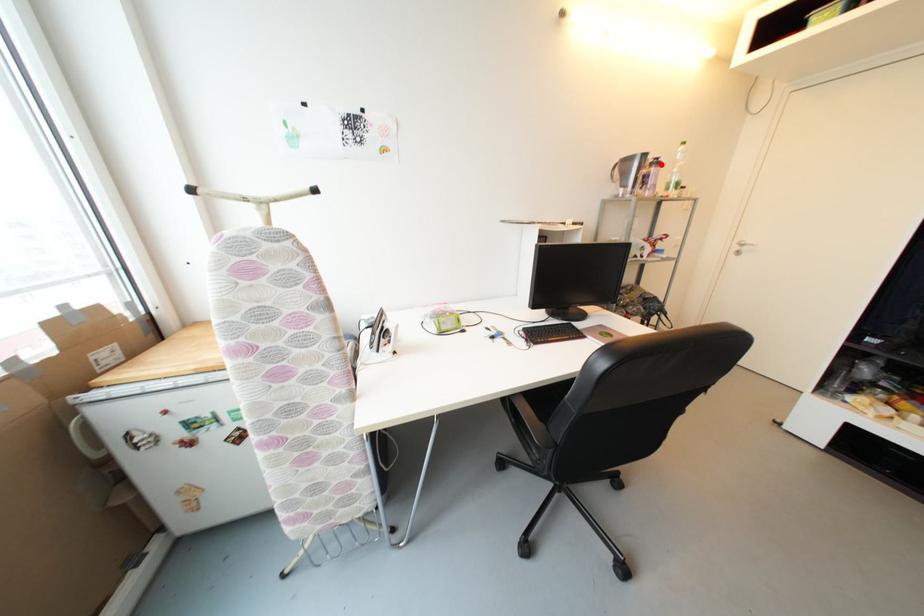
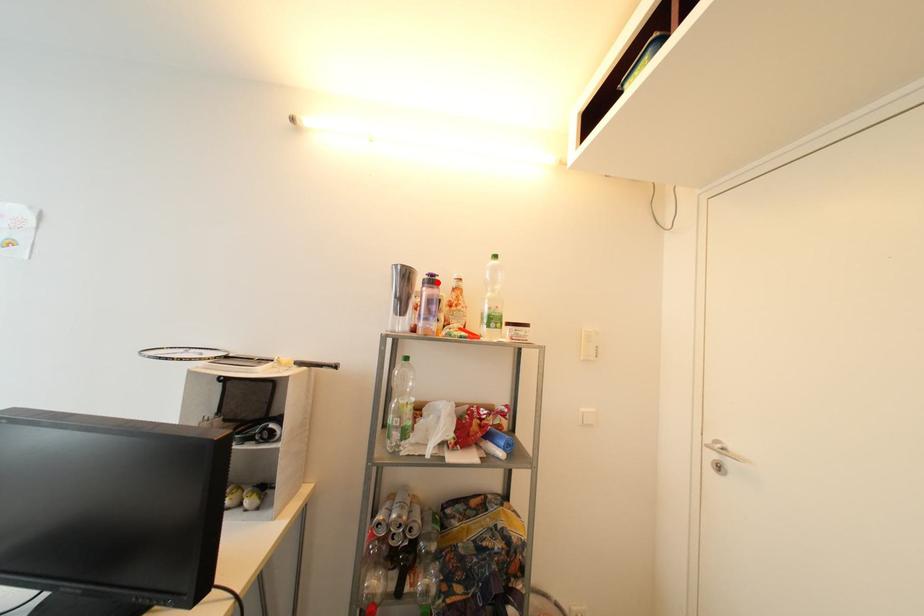
I am providing you with two images of the same scene from different viewpoints. A red point is marked on the first image and another point is marked on the second image. Does the point marked in image1 correspond to the same location as the one in image2?

Yes